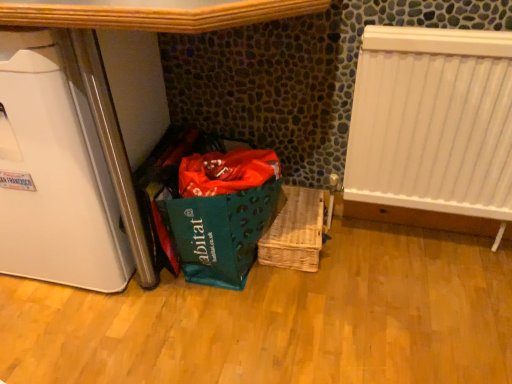
Image resolution: width=512 pixels, height=384 pixels. In order to click on vacant space in front of woven wood basket at center in this screenshot , I will do `click(298, 294)`.